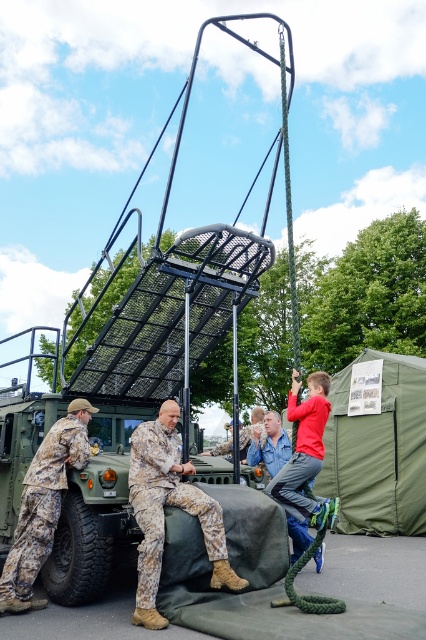
Is green canvas tent at right above camouflage fabric soldier at lower left?

No.

Does green canvas tent at right appear on the left side of camouflage fabric soldier at lower left?

Incorrect, green canvas tent at right is not on the left side of camouflage fabric soldier at lower left.

Does point (347, 433) come farther from viewer compared to point (83, 417)?

Yes, it is.

Identify the location of green canvas tent at right. Image resolution: width=426 pixels, height=640 pixels. (379, 451).

Which of these two, green canvas tent at right or camouflage fabric pants at center, stands shorter?

camouflage fabric pants at center is shorter.

Who is more distant from viewer, (399, 506) or (146, 515)?

Point (399, 506)

This screenshot has height=640, width=426. Describe the element at coordinates (379, 451) in the screenshot. I see `green canvas tent at right` at that location.

The image size is (426, 640). In order to click on green canvas tent at right in this screenshot , I will do `click(379, 451)`.

This screenshot has height=640, width=426. What do you see at coordinates (169, 504) in the screenshot?
I see `camouflage fabric pants at center` at bounding box center [169, 504].

Locate an element on the screen. camouflage fabric pants at center is located at coordinates (169, 504).

Which is in front, point (230, 573) or point (34, 538)?

Point (230, 573) is in front.

Where is `camouflage fabric pants at center`? camouflage fabric pants at center is located at coordinates (169, 504).